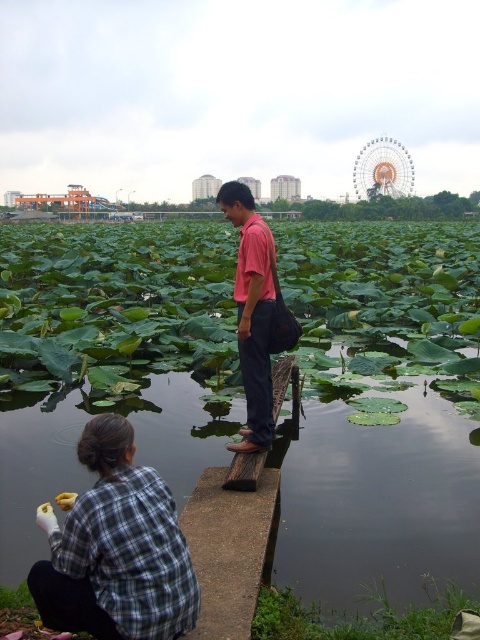
Question: Does plaid fabric shirt at lower left appear under pink matte shirt at center?

Choices:
 (A) yes
 (B) no

Answer: (A)

Question: Among these objects, which one is nearest to the camera?

Choices:
 (A) plaid fabric shirt at lower left
 (B) pink matte shirt at center

Answer: (A)

Question: Can you confirm if plaid fabric shirt at lower left is wider than pink matte shirt at center?

Choices:
 (A) yes
 (B) no

Answer: (A)

Question: Which point is farther to the camera?

Choices:
 (A) pink matte shirt at center
 (B) plaid fabric shirt at lower left

Answer: (A)

Question: Is plaid fabric shirt at lower left thinner than pink matte shirt at center?

Choices:
 (A) no
 (B) yes

Answer: (A)